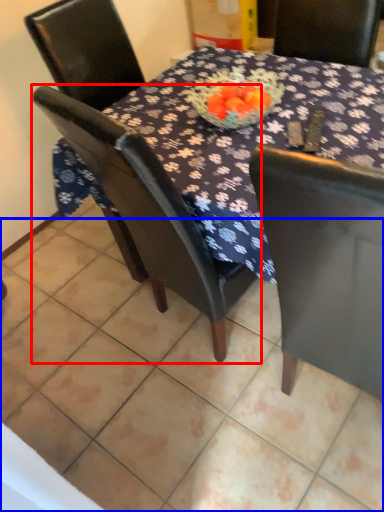
Question: Among these objects, which one is nearest to the camera, chair (highlighted by a red box) or tile (highlighted by a blue box)?

Choices:
 (A) chair
 (B) tile

Answer: (A)